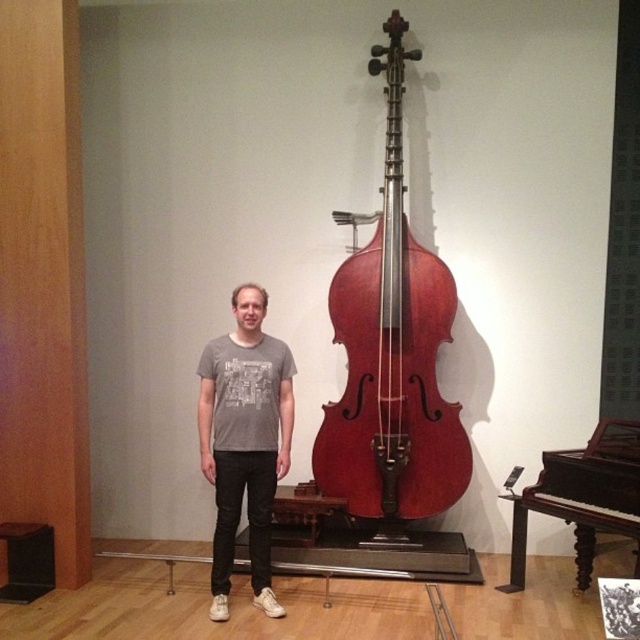
Question: Estimate the real-world distances between objects in this image. Which object is closer to the gray t-shirt at center?

Choices:
 (A) black wood stool at lower left
 (B) shiny varnished violin at center

Answer: (B)

Question: Which point appears farthest from the camera in this image?

Choices:
 (A) (248, 403)
 (B) (504, 584)

Answer: (B)

Question: Which object appears closest to the camera in this image?

Choices:
 (A) black wood stool at lower left
 (B) shiny varnished violin at center

Answer: (A)

Question: Does shiny varnished violin at center appear on the right side of polished dark wood piano at lower right?

Choices:
 (A) no
 (B) yes

Answer: (A)

Question: Can you confirm if gray t-shirt at center is thinner than black wood stool at lower left?

Choices:
 (A) no
 (B) yes

Answer: (A)

Question: From the image, what is the correct spatial relationship of shiny varnished violin at center in relation to gray t-shirt at center?

Choices:
 (A) right
 (B) left

Answer: (A)